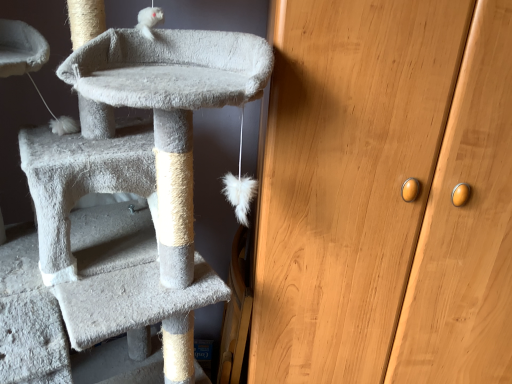
Question: Is wooden cabinet at right wider or thinner than soft gray carpeted cat tree at left?

Choices:
 (A) wide
 (B) thin

Answer: (B)

Question: Visually, is wooden cabinet at right positioned to the left or to the right of soft gray carpeted cat tree at left?

Choices:
 (A) left
 (B) right

Answer: (B)

Question: Considering the positions of wooden cabinet at right and soft gray carpeted cat tree at left in the image, is wooden cabinet at right bigger or smaller than soft gray carpeted cat tree at left?

Choices:
 (A) small
 (B) big

Answer: (B)

Question: Is soft gray carpeted cat tree at left inside or outside of wooden cabinet at right?

Choices:
 (A) inside
 (B) outside

Answer: (B)

Question: Does point (241, 57) appear closer or farther from the camera than point (305, 107)?

Choices:
 (A) farther
 (B) closer

Answer: (B)

Question: Considering the positions of soft gray carpeted cat tree at left and wooden cabinet at right in the image, is soft gray carpeted cat tree at left taller or shorter than wooden cabinet at right?

Choices:
 (A) short
 (B) tall

Answer: (A)

Question: From the image's perspective, relative to wooden cabinet at right, is soft gray carpeted cat tree at left above or below?

Choices:
 (A) above
 (B) below

Answer: (B)